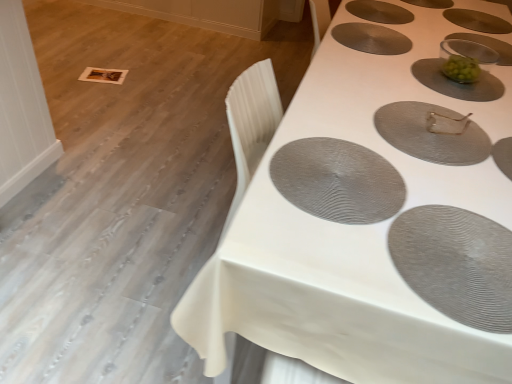
What are the coordinates of `vacant area that lies to the right of textured gray oval at center, the 6th oval in the back-to-front sequence` in the screenshot? It's located at (451, 182).